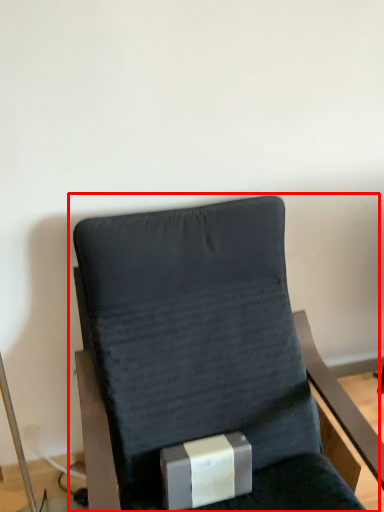
Question: Observing the image, what is the correct spatial positioning of chair (annotated by the red box) in reference to box?

Choices:
 (A) left
 (B) right

Answer: (B)